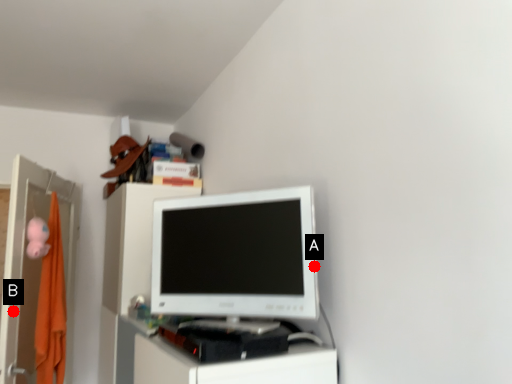
Question: Two points are circled on the image, labeled by A and B beside each circle. Which point is farther to the camera?

Choices:
 (A) A is further
 (B) B is further

Answer: (B)